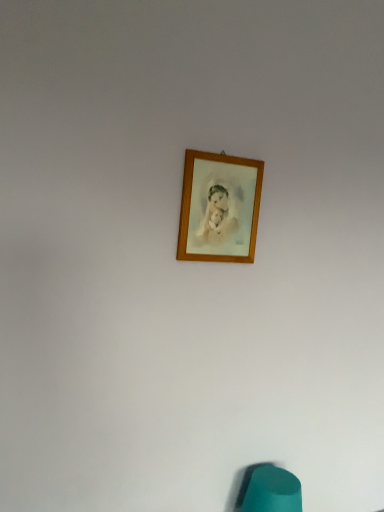
The image size is (384, 512). In order to click on wooden picture frame at upper center in this screenshot , I will do `click(219, 208)`.

What do you see at coordinates (219, 208) in the screenshot? I see `wooden picture frame at upper center` at bounding box center [219, 208].

What is the approximate height of teal fabric bean bag chair at lower center?

The height of teal fabric bean bag chair at lower center is 7.75 inches.

Locate an element on the screen. This screenshot has width=384, height=512. teal fabric bean bag chair at lower center is located at coordinates (269, 490).

The height and width of the screenshot is (512, 384). Describe the element at coordinates (269, 490) in the screenshot. I see `teal fabric bean bag chair at lower center` at that location.

The width and height of the screenshot is (384, 512). In order to click on wooden picture frame at upper center in this screenshot , I will do `click(219, 208)`.

Which object is positioned more to the left, teal fabric bean bag chair at lower center or wooden picture frame at upper center?

wooden picture frame at upper center.

Based on the photo, which object is more forward, teal fabric bean bag chair at lower center or wooden picture frame at upper center?

Positioned in front is wooden picture frame at upper center.

Considering the positions of points (257, 466) and (228, 218), is point (257, 466) closer to camera compared to point (228, 218)?

No, it is behind (228, 218).

From the image's perspective, is teal fabric bean bag chair at lower center on wooden picture frame at upper center?

No.

From a real-world perspective, which object stands above the other?

wooden picture frame at upper center, from a real-world perspective.

Between teal fabric bean bag chair at lower center and wooden picture frame at upper center, which one has larger width?

teal fabric bean bag chair at lower center.

Considering the relative sizes of teal fabric bean bag chair at lower center and wooden picture frame at upper center in the image provided, is teal fabric bean bag chair at lower center shorter than wooden picture frame at upper center?

Correct, teal fabric bean bag chair at lower center is not as tall as wooden picture frame at upper center.

Between teal fabric bean bag chair at lower center and wooden picture frame at upper center, which one has smaller size?

Smaller between the two is wooden picture frame at upper center.

Is teal fabric bean bag chair at lower center outside of wooden picture frame at upper center?

teal fabric bean bag chair at lower center is positioned outside wooden picture frame at upper center.

Would you say teal fabric bean bag chair at lower center is a long distance from wooden picture frame at upper center?

teal fabric bean bag chair at lower center is actually quite close to wooden picture frame at upper center.

Is teal fabric bean bag chair at lower center oriented away from wooden picture frame at upper center?

No, wooden picture frame at upper center is not at the back of teal fabric bean bag chair at lower center.

Consider the image. How many degrees apart are the facing directions of teal fabric bean bag chair at lower center and wooden picture frame at upper center?

They differ by 2.24 degrees in their facing directions.

Locate an element on the screen. This screenshot has width=384, height=512. picture frame positioned vertically above the teal fabric bean bag chair at lower center (from a real-world perspective) is located at coordinates (219, 208).

Which is more to the right, wooden picture frame at upper center or teal fabric bean bag chair at lower center?

teal fabric bean bag chair at lower center is more to the right.

Is the position of wooden picture frame at upper center more distant than that of teal fabric bean bag chair at lower center?

That is False.

Which is behind, point (217, 248) or point (286, 474)?

The point (286, 474) is farther.

From the image's perspective, is wooden picture frame at upper center under teal fabric bean bag chair at lower center?

No, from the image's perspective, wooden picture frame at upper center is not beneath teal fabric bean bag chair at lower center.

From a real-world perspective, is wooden picture frame at upper center on teal fabric bean bag chair at lower center?

Yes.

Which of these two, wooden picture frame at upper center or teal fabric bean bag chair at lower center, is thinner?

With smaller width is wooden picture frame at upper center.

From the picture: From their relative heights in the image, would you say wooden picture frame at upper center is taller or shorter than teal fabric bean bag chair at lower center?

Considering their sizes, wooden picture frame at upper center has more height than teal fabric bean bag chair at lower center.

Considering the relative sizes of wooden picture frame at upper center and teal fabric bean bag chair at lower center in the image provided, is wooden picture frame at upper center bigger than teal fabric bean bag chair at lower center?

Incorrect, wooden picture frame at upper center is not larger than teal fabric bean bag chair at lower center.

Would you say wooden picture frame at upper center is inside or outside teal fabric bean bag chair at lower center?

wooden picture frame at upper center exists outside the volume of teal fabric bean bag chair at lower center.

Is wooden picture frame at upper center far from teal fabric bean bag chair at lower center?

Actually, wooden picture frame at upper center and teal fabric bean bag chair at lower center are a little close together.

Is wooden picture frame at upper center oriented towards teal fabric bean bag chair at lower center?

No, wooden picture frame at upper center is not facing towards teal fabric bean bag chair at lower center.

Image resolution: width=384 pixels, height=512 pixels. Identify the location of bean bag chair on the right of wooden picture frame at upper center. (269, 490).

Image resolution: width=384 pixels, height=512 pixels. In the image, there is a wooden picture frame at upper center. Find the location of `bean bag chair below it (from a real-world perspective)`. bean bag chair below it (from a real-world perspective) is located at coordinates (269, 490).

Locate an element on the screen. bean bag chair on the right of wooden picture frame at upper center is located at coordinates (269, 490).